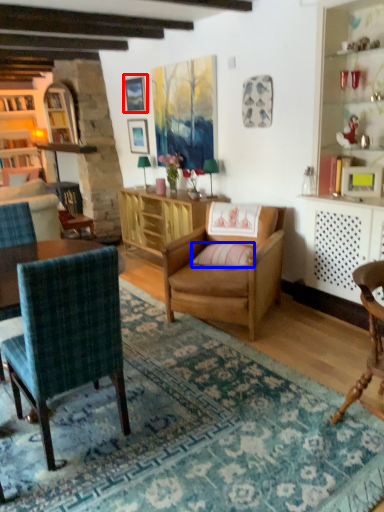
Question: Which object appears closest to the camera in this image, picture frame (highlighted by a red box) or pillow (highlighted by a blue box)?

Choices:
 (A) picture frame
 (B) pillow

Answer: (B)